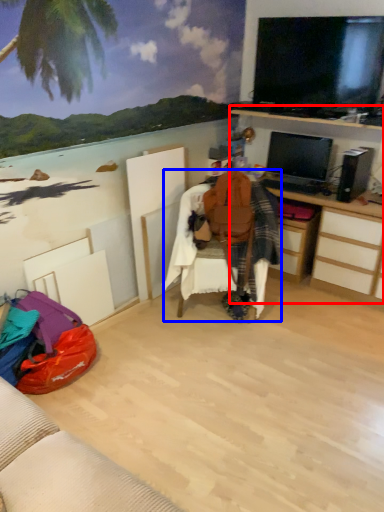
Question: Which object appears farthest to the camera in this image, computer desk (highlighted by a red box) or bean bag chair (highlighted by a blue box)?

Choices:
 (A) computer desk
 (B) bean bag chair

Answer: (A)